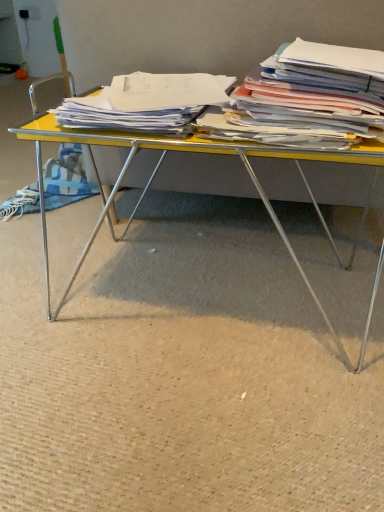
The height and width of the screenshot is (512, 384). I want to click on vacant area situated to the left side of yellow plastic desk at center, so click(x=52, y=281).